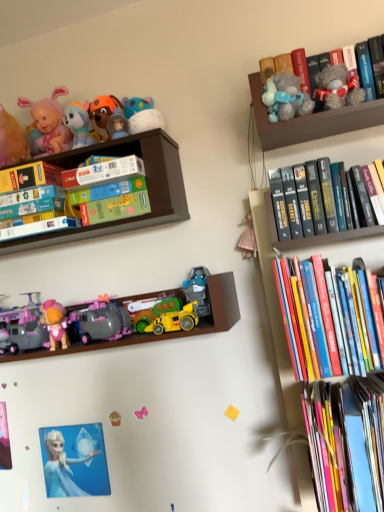
Question: Is matte purple plastic toy car at lower left, which is the 3th toy in bottom-to-top order, in front of or behind hardcover books at upper right, the 1th book from the top, in the image?

Choices:
 (A) front
 (B) behind

Answer: (B)

Question: In terms of size, does matte purple plastic toy car at lower left, placed as the 7th toy when sorted from right to left, appear bigger or smaller than hardcover books at upper right, the 1th book from the top?

Choices:
 (A) small
 (B) big

Answer: (A)

Question: Considering the real-world distances, which object is closest to the fluffy gray teddy bear at upper right, the 7th toy positioned from the bottom?

Choices:
 (A) hardcover book at left, positioned as the 2th paperback book in top-to-bottom order
 (B) matte plastic toy car at center, which is the fourth toy from top to bottom
 (C) white matte paperback book at upper center, marked as the first paperback book in a top-to-bottom arrangement
 (D) fluffy gray teddy bear at upper right, which is the 2th toy from top to bottom
 (E) pink fabric bow at center, the second toy from the bottom

Answer: (D)

Question: Estimate the real-world distances between objects in this image. Which object is farther from the plush toy at upper left, which is the sixth toy from right to left?

Choices:
 (A) yellow plastic toy car at center
 (B) hardcover book at right, which is the first book from bottom to top
 (C) pink fabric bow at center, the second toy from the bottom
 (D) hardcover book at right, the second book in the top-to-bottom sequence
 (E) pink fabric doll at lower left, arranged as the fourth toy when viewed from the left

Answer: (B)